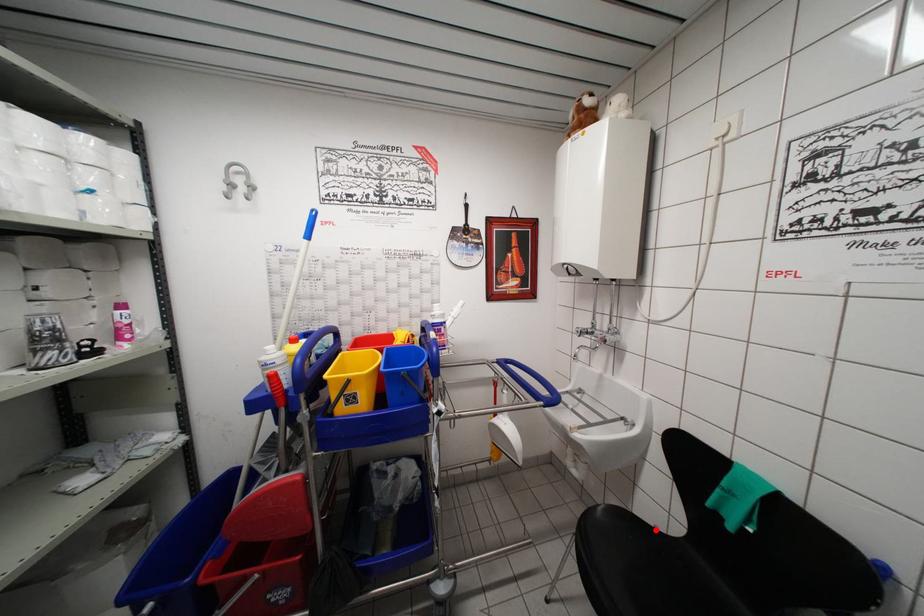
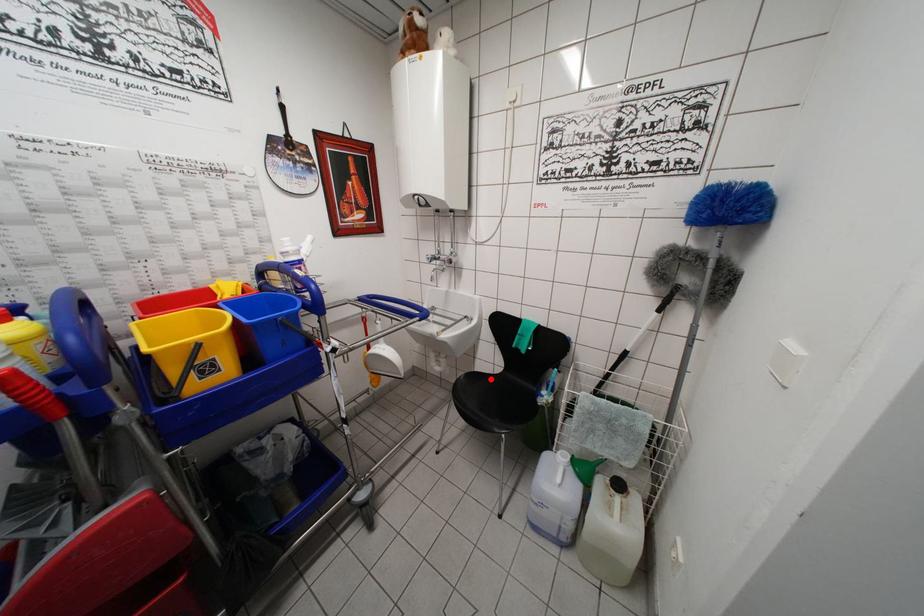
I am providing you with two images of the same scene from different viewpoints. A red point is marked on the first image and another point is marked on the second image. Do the highlighted points in image1 and image2 indicate the same real-world spot?

Yes